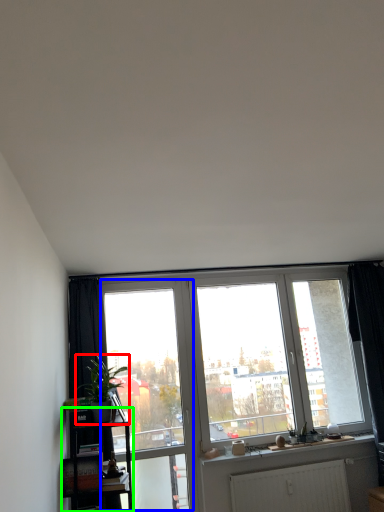
Question: Which object is positioned closest to houseplant (highlighted by a red box)? Select from screen door (highlighted by a blue box) and shelf (highlighted by a green box).

Choices:
 (A) screen door
 (B) shelf

Answer: (B)